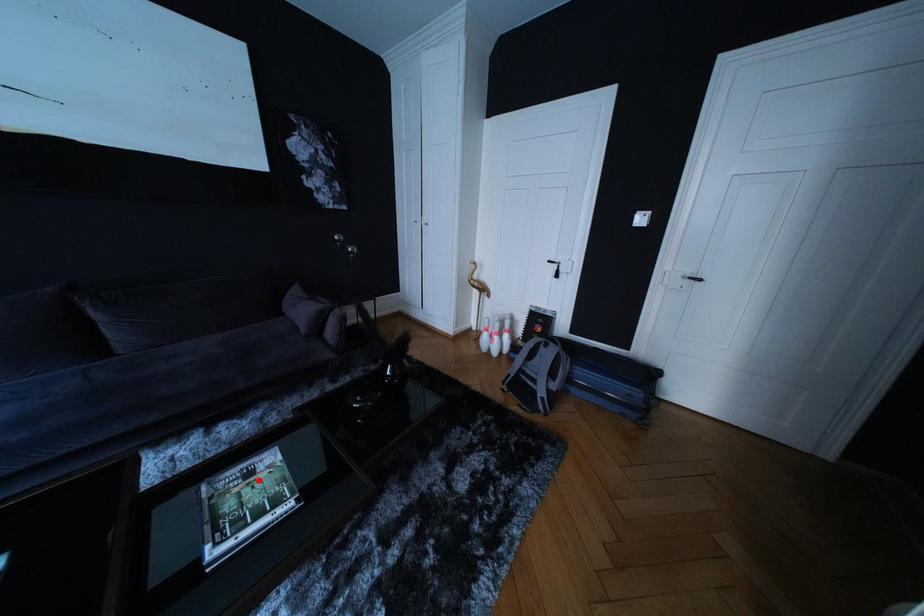
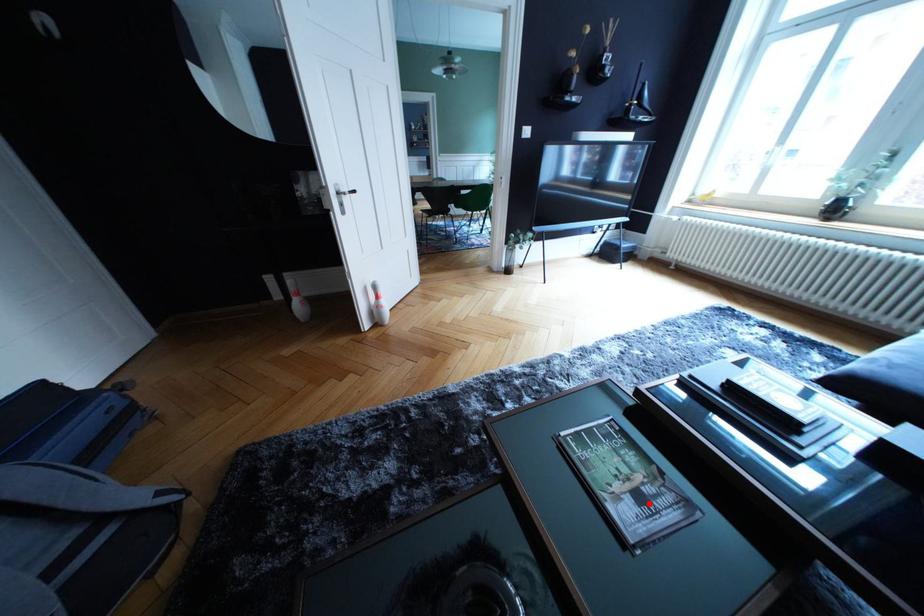
I am providing you with two images of the same scene from different viewpoints. A red point is marked on the first image and another point is marked on the second image. Do the highlighted points in image1 and image2 indicate the same real-world spot?

Yes